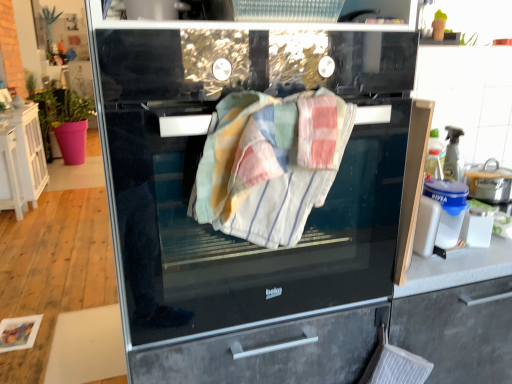
Question: From a real-world perspective, is white wood cabinet at left located beneath patchwork cotton towel at center?

Choices:
 (A) yes
 (B) no

Answer: (A)

Question: Is white wood cabinet at left further to camera compared to patchwork cotton towel at center?

Choices:
 (A) no
 (B) yes

Answer: (B)

Question: Is white wood cabinet at left taller than patchwork cotton towel at center?

Choices:
 (A) yes
 (B) no

Answer: (A)

Question: Is white wood cabinet at left at the right side of patchwork cotton towel at center?

Choices:
 (A) no
 (B) yes

Answer: (A)

Question: From a real-world perspective, is white wood cabinet at left physically above patchwork cotton towel at center?

Choices:
 (A) yes
 (B) no

Answer: (B)

Question: From a real-world perspective, relative to patchwork cotton towel at center, is black glass oven at center vertically above or below?

Choices:
 (A) below
 (B) above

Answer: (A)

Question: Do you think black glass oven at center is within patchwork cotton towel at center, or outside of it?

Choices:
 (A) outside
 (B) inside

Answer: (A)

Question: From their relative heights in the image, would you say black glass oven at center is taller or shorter than patchwork cotton towel at center?

Choices:
 (A) tall
 (B) short

Answer: (A)

Question: Is black glass oven at center in front of or behind patchwork cotton towel at center in the image?

Choices:
 (A) behind
 (B) front

Answer: (B)

Question: Is point (471, 190) positioned closer to the camera than point (10, 162)?

Choices:
 (A) farther
 (B) closer

Answer: (B)

Question: Relative to white wood cabinet at left, is blue plastic container at right in front or behind?

Choices:
 (A) front
 (B) behind

Answer: (A)

Question: In terms of size, does blue plastic container at right appear bigger or smaller than white wood cabinet at left?

Choices:
 (A) small
 (B) big

Answer: (A)

Question: In terms of height, does blue plastic container at right look taller or shorter compared to white wood cabinet at left?

Choices:
 (A) tall
 (B) short

Answer: (B)

Question: Is black glass oven at center in front of or behind white wood cabinet at left in the image?

Choices:
 (A) behind
 (B) front

Answer: (B)

Question: Is black glass oven at center wider or thinner than white wood cabinet at left?

Choices:
 (A) wide
 (B) thin

Answer: (A)